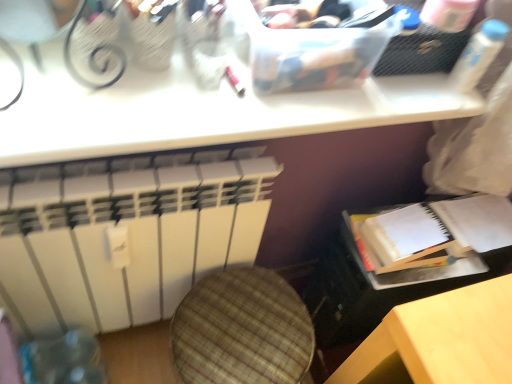
Where is `vacant area on top of white matte radiator at lower left (from a real-world perspective)`? vacant area on top of white matte radiator at lower left (from a real-world perspective) is located at coordinates (100, 172).